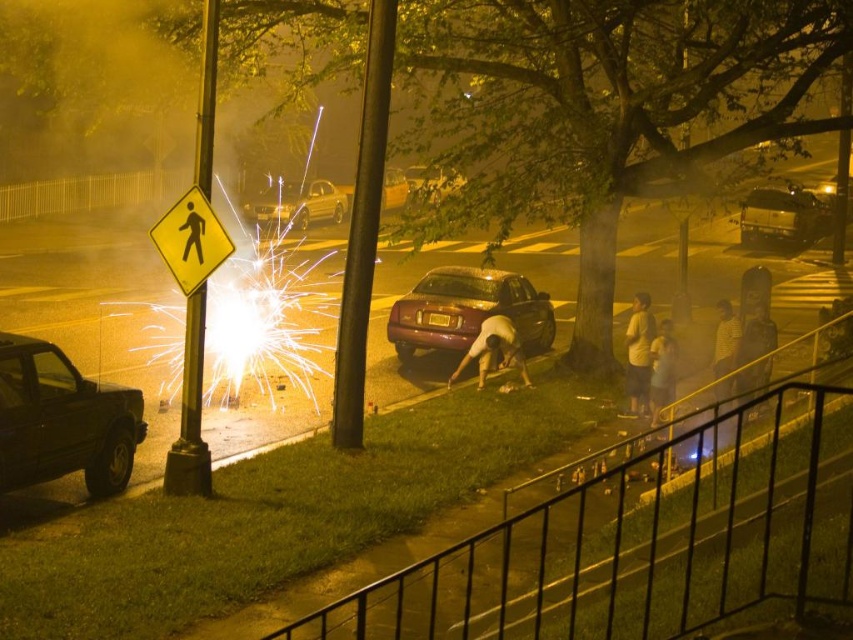
Between black matte car at left and metallic maroon sedan at center, which one appears on the right side from the viewer's perspective?

Positioned to the right is metallic maroon sedan at center.

Between point (91, 419) and point (344, 195), which one is positioned in front?

Point (91, 419) is more forward.

Where is `black matte car at left`? This screenshot has height=640, width=853. black matte car at left is located at coordinates (62, 420).

From the picture: Measure the distance between maroon metallic sedan at center and light blue shirt at lower right.

maroon metallic sedan at center is 4.43 meters from light blue shirt at lower right.

Who is more forward, (444,333) or (669,337)?

Point (669,337) is more forward.

Who is more forward, (469,305) or (664,385)?

Positioned in front is point (664,385).

You are a GUI agent. You are given a task and a screenshot of the screen. Output one action in this format:
    pyautogui.click(x=<x>, y=<y>)
    Task: Click on the maroon metallic sedan at center
    This screenshot has width=853, height=640.
    Given the screenshot: What is the action you would take?
    pyautogui.click(x=467, y=310)

Is yellow matte pedestrian sign at left closer to the viewer compared to metallic maroon sedan at center?

Yes, yellow matte pedestrian sign at left is closer to the viewer.

Measure the distance from yellow matte pedestrian sign at left to metallic maroon sedan at center.

yellow matte pedestrian sign at left and metallic maroon sedan at center are 6.26 meters apart from each other.

Which is behind, point (201, 253) or point (386, 198)?

The point (386, 198) is more distant.

The width and height of the screenshot is (853, 640). In order to click on yellow matte pedestrian sign at left in this screenshot , I will do click(190, 241).